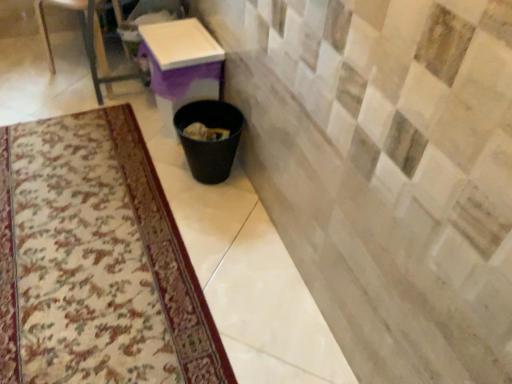
Find the location of a particular element. The height and width of the screenshot is (384, 512). free spot in front of black plastic trash can at lower center is located at coordinates (206, 215).